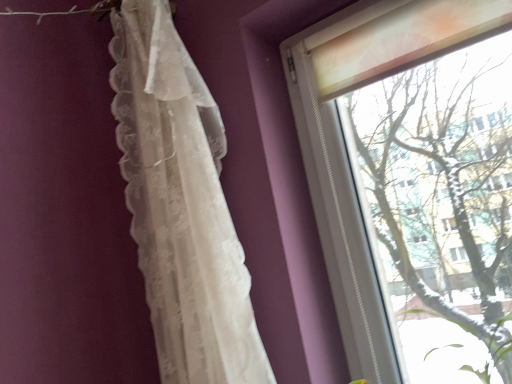
Locate an element on the screen. white lace curtain at left is located at coordinates (181, 205).

Image resolution: width=512 pixels, height=384 pixels. What do you see at coordinates (181, 205) in the screenshot?
I see `white lace curtain at left` at bounding box center [181, 205].

In order to face white lace curtain at left, should I rotate leftwards or rightwards?

A 8.985 degree turn to the left will do.

Find the location of a particular element. The width and height of the screenshot is (512, 384). white lace curtain at left is located at coordinates (181, 205).